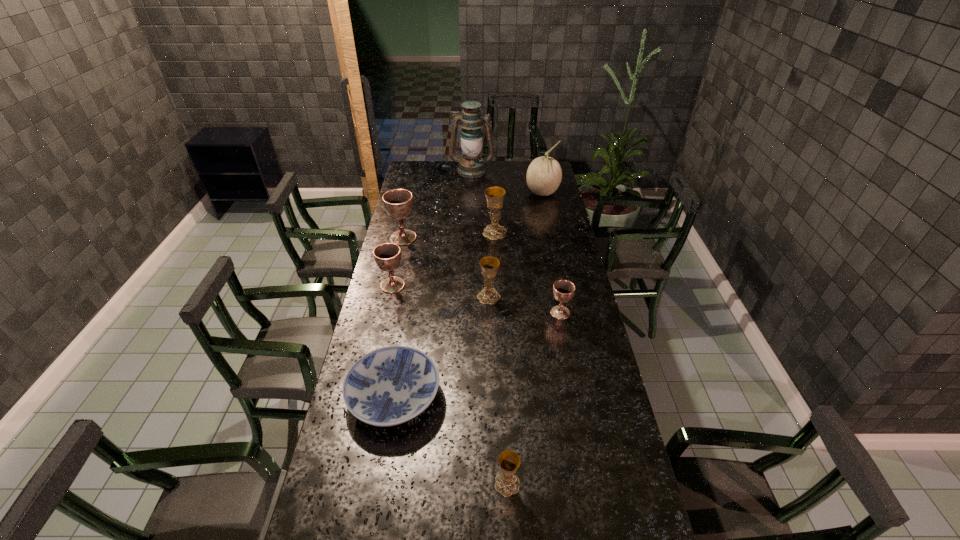
The width and height of the screenshot is (960, 540). Find the location of `vacant region between the biggest brown chalice and the shortest object`. vacant region between the biggest brown chalice and the shortest object is located at coordinates (398, 317).

Find the location of a particular element. The width and height of the screenshot is (960, 540). free space between the eighth shortest object and the blue plate is located at coordinates (468, 295).

This screenshot has height=540, width=960. I want to click on vacant area between the nearest object and the oil lamp, so click(490, 327).

I want to click on free space between the second farthest object and the eighth farthest object, so click(x=468, y=295).

At what (x,y) coordinates should I click in order to perform the action: click on vacant area that lies between the farthest brown chalice and the biggest gold chalice. Please return your answer as a coordinate pair (x, y). The image size is (960, 540). Looking at the image, I should click on (449, 235).

Where is `free space between the nearest brown chalice and the second nearest brown chalice`? free space between the nearest brown chalice and the second nearest brown chalice is located at coordinates (476, 299).

You are a GUI agent. You are given a task and a screenshot of the screen. Output one action in this format:
    pyautogui.click(x=<x>, y=<y>)
    Task: Click on the free space between the biggest gold chalice and the second nearest object
    This screenshot has width=960, height=540.
    Given the screenshot: What is the action you would take?
    (x=444, y=314)

The image size is (960, 540). I want to click on free space between the blue plate and the oil lamp, so click(x=433, y=283).

Where is `free space between the cantaloup and the biggest gold chalice`? The height and width of the screenshot is (540, 960). free space between the cantaloup and the biggest gold chalice is located at coordinates (518, 213).

At what (x,y) coordinates should I click in order to perform the action: click on blank region between the second smallest brown chalice and the plate. Please return your answer as a coordinate pair (x, y). The height and width of the screenshot is (540, 960). Looking at the image, I should click on (394, 341).